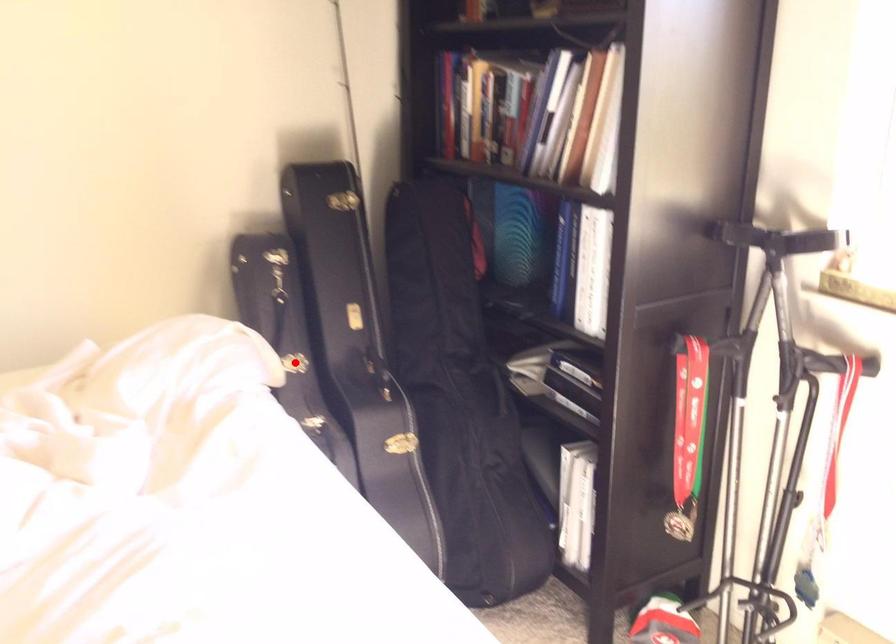
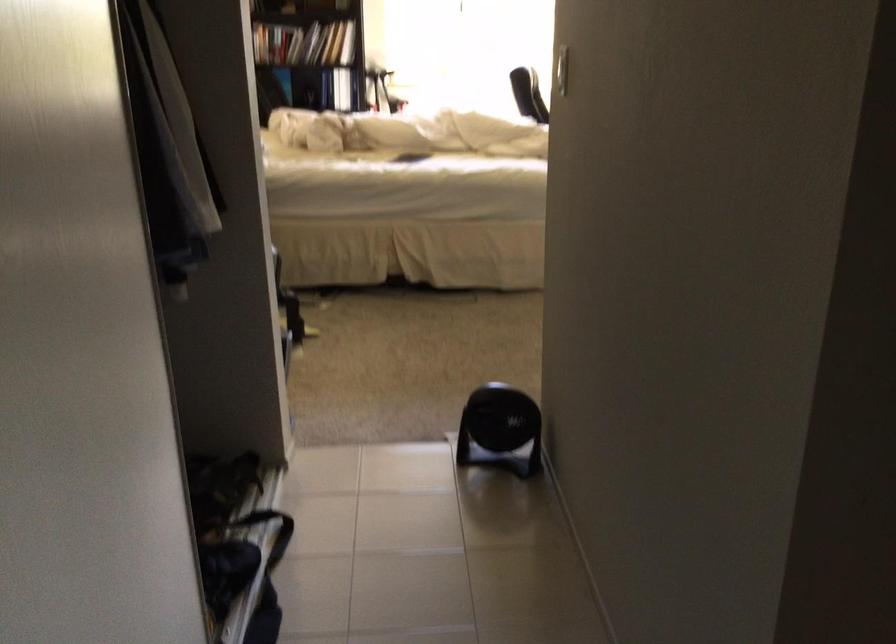
Question: I am providing you with two images of the same scene from different viewpoints. A red point is marked on the first image. At the location where the point appears in image 1, is it still visible in image 2?

Choices:
 (A) Yes
 (B) No

Answer: (B)